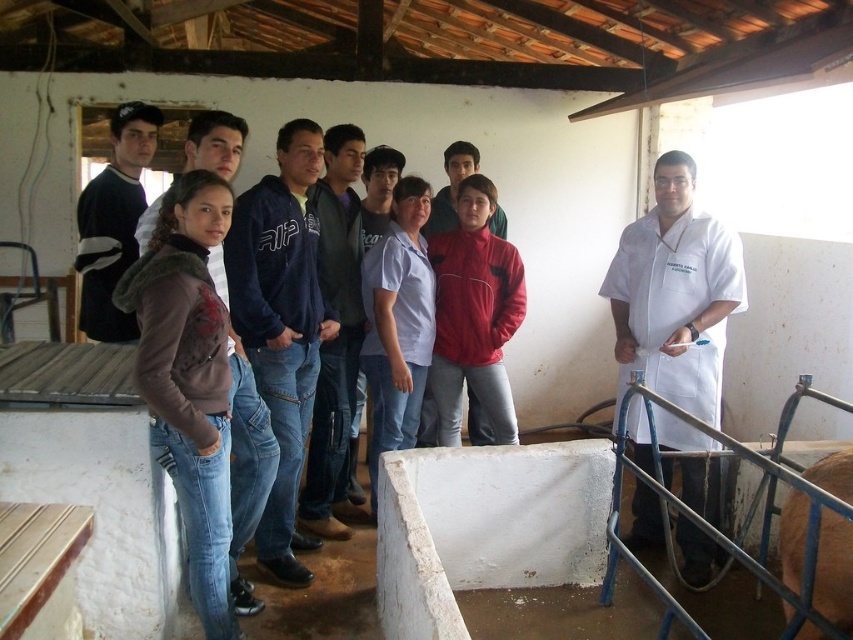
Question: Which point is closer to the camera?

Choices:
 (A) (316, 422)
 (B) (144, 132)
 (C) (619, 481)

Answer: (C)

Question: Is brown fur at lower right above matte blue hoodie at center?

Choices:
 (A) no
 (B) yes

Answer: (A)

Question: Among these objects, which one is farthest from the camera?

Choices:
 (A) white lab coat at right
 (B) brown leather jacket at left
 (C) dark blue hoodie at center
 (D) dark blue jersey at center

Answer: (D)

Question: Based on their relative distances, which object is nearer to the dark blue jersey at center?

Choices:
 (A) white lab coat at right
 (B) blue denim jeans at center
 (C) blue metal rail at lower right

Answer: (B)

Question: Where is blue denim jeans at center located in relation to blue metal rail at lower right in the image?

Choices:
 (A) below
 (B) above

Answer: (B)

Question: Can you confirm if brown leather jacket at left is wider than brown fur at lower right?

Choices:
 (A) yes
 (B) no

Answer: (A)